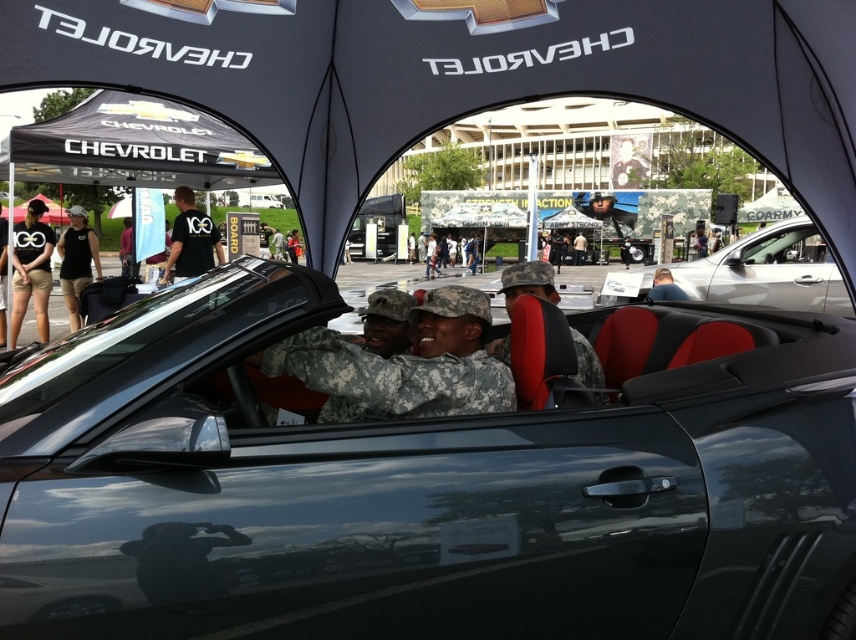
Question: Does camouflage fabric uniform at center lie behind silver metallic car at center?

Choices:
 (A) no
 (B) yes

Answer: (A)

Question: Does black cotton shirt at left lie behind black matte t-shirt at upper left?

Choices:
 (A) no
 (B) yes

Answer: (B)

Question: Can you confirm if silver metallic car at center is bigger than black matte t-shirt at upper left?

Choices:
 (A) yes
 (B) no

Answer: (B)

Question: Estimate the real-world distances between objects in this image. Which object is farther from the silver metallic car at center?

Choices:
 (A) camouflage fabric uniform at center
 (B) glossy black convertible at center

Answer: (A)

Question: Which object appears closest to the camera in this image?

Choices:
 (A) black matte t-shirt at upper left
 (B) silver metallic car at center
 (C) black cotton shirt at left
 (D) glossy black convertible at center

Answer: (D)

Question: Which object appears farthest from the camera in this image?

Choices:
 (A) glossy black convertible at center
 (B) camouflage fabric uniform at center

Answer: (B)